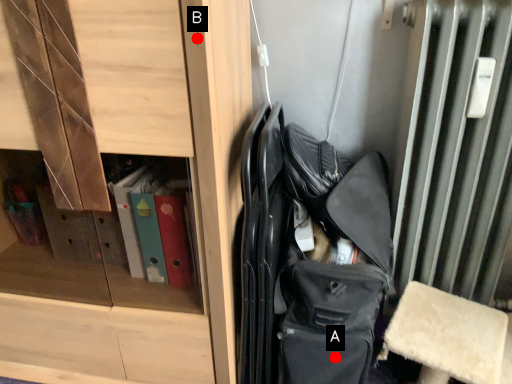
Question: Two points are circled on the image, labeled by A and B beside each circle. Which point is closer to the camera?

Choices:
 (A) A is closer
 (B) B is closer

Answer: (B)